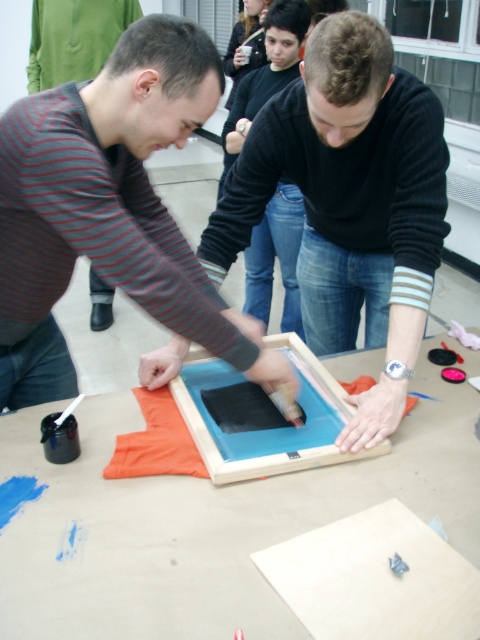
Who is taller, wooden table at center or striped cotton shirt at center?

striped cotton shirt at center is taller.

Who is higher up, wooden table at center or striped cotton shirt at center?

Positioned higher is striped cotton shirt at center.

Is point (72, 516) positioned after point (66, 152)?

Yes.

Identify the location of wooden table at center. (206, 524).